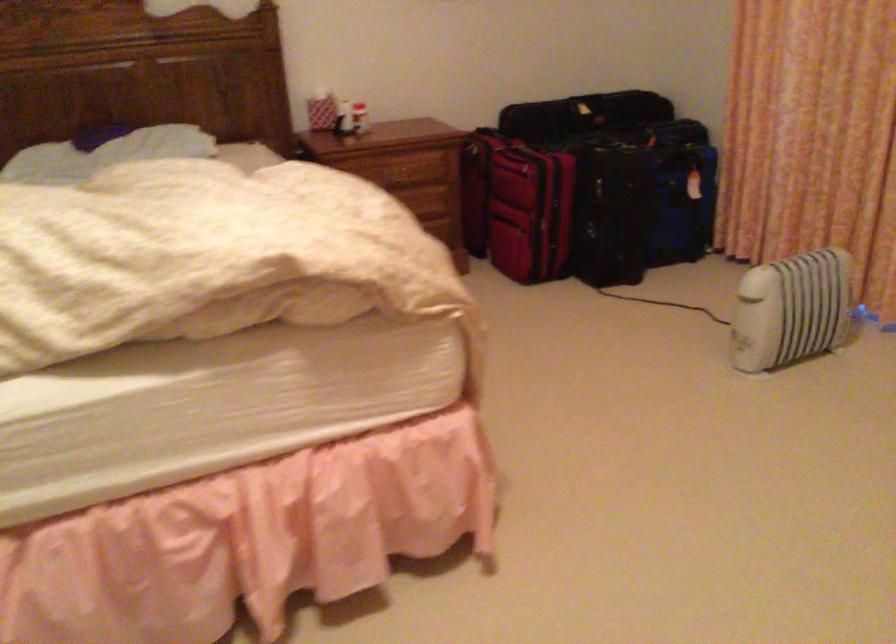
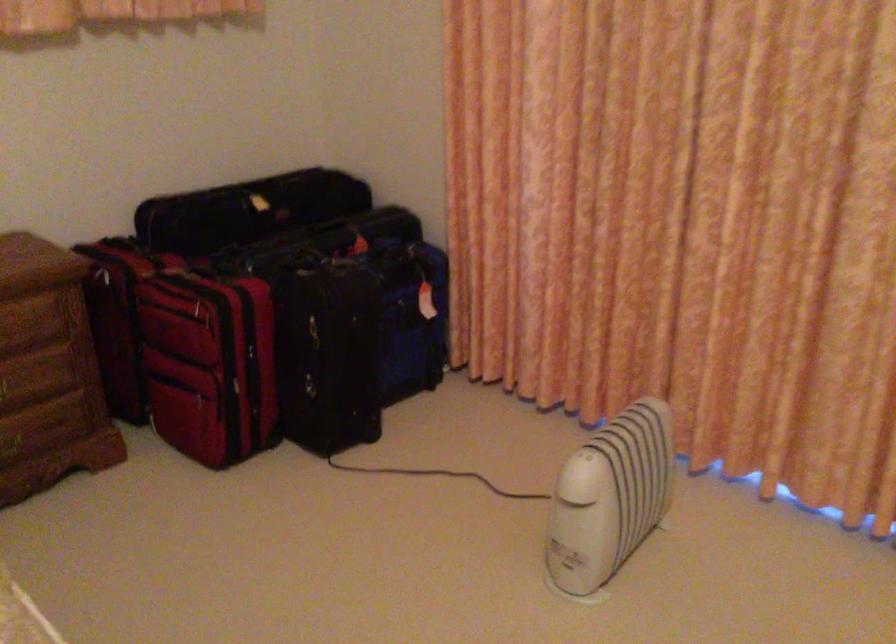
In the second image, find the point that corresponds to the point at 521,205 in the first image.

(209, 364)